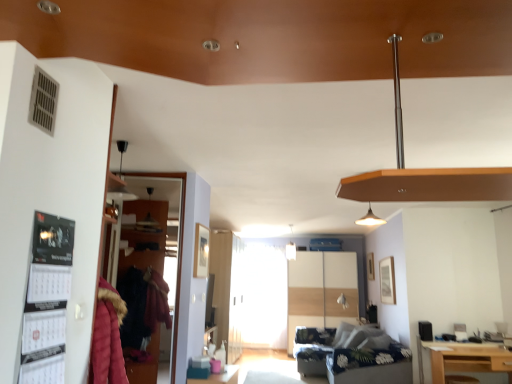
In order to click on dark blue floral fabric couch at lower center in this screenshot , I will do `click(354, 357)`.

I want to click on light brown wooden table at lower right, so click(463, 359).

Describe the element at coordinates (321, 290) in the screenshot. The height and width of the screenshot is (384, 512). I see `matte wood sliding door at center, the second glass door positioned from the left` at that location.

Identify the location of transparent glass door at left, placed as the second glass door when sorted from right to left. The image size is (512, 384). (178, 245).

Could you tell me if dark blue floral fabric couch at lower center is turned towards transparent glass door at left, which is the 1th glass door from front to back?

No, dark blue floral fabric couch at lower center is not aimed at transparent glass door at left, which is the 1th glass door from front to back.

From the image's perspective, is dark blue floral fabric couch at lower center located beneath transparent glass door at left, which is the 2th glass door from back to front?

Yes, from the image's perspective, dark blue floral fabric couch at lower center is beneath transparent glass door at left, which is the 2th glass door from back to front.

Is dark blue floral fabric couch at lower center at the left side of transparent glass door at left, arranged as the second glass door when ordered from the bottom?

No.

Who is taller, dark blue floral fabric couch at lower center or transparent glass door at left, arranged as the second glass door when ordered from the bottom?

transparent glass door at left, arranged as the second glass door when ordered from the bottom, is taller.

Between transparent glass door at left, which is the 1th glass door from front to back, and light brown wooden table at lower right, which one has less height?

With less height is light brown wooden table at lower right.

Is the surface of transparent glass door at left, placed as the second glass door when sorted from right to left, in direct contact with light brown wooden table at lower right?

No, transparent glass door at left, placed as the second glass door when sorted from right to left, is not next to light brown wooden table at lower right.

What's the angular difference between transparent glass door at left, which is the 1th glass door from front to back, and light brown wooden table at lower right's facing directions?

transparent glass door at left, which is the 1th glass door from front to back, and light brown wooden table at lower right are facing 0.289 degrees away from each other.

Is there a large distance between black paper calendar at left and dark blue floral fabric couch at lower center?

Yes.

Is black paper calendar at left looking in the opposite direction of dark blue floral fabric couch at lower center?

black paper calendar at left is not turned away from dark blue floral fabric couch at lower center.

From the image's perspective, who appears lower, black paper calendar at left or dark blue floral fabric couch at lower center?

dark blue floral fabric couch at lower center, from the image's perspective.

Can you confirm if black paper calendar at left is shorter than dark blue floral fabric couch at lower center?

Yes.

Considering the sizes of light brown wooden table at lower right and matte wood sliding door at center, the 1th glass door positioned from the back, in the image, is light brown wooden table at lower right wider or thinner than matte wood sliding door at center, the 1th glass door positioned from the back,?

Considering their sizes, light brown wooden table at lower right looks slimmer than matte wood sliding door at center, the 1th glass door positioned from the back.

Can you confirm if light brown wooden table at lower right is bigger than matte wood sliding door at center, which is counted as the 2th glass door, starting from the top?

No.

From a real-world perspective, which is physically below, light brown wooden table at lower right or matte wood sliding door at center, the 1th glass door positioned from the back?

In real-world perspective, light brown wooden table at lower right is lower.

Does point (498, 349) appear closer or farther from the camera than point (334, 291)?

Clearly, point (498, 349) is closer to the camera than point (334, 291).

From the image's perspective, is black paper calendar at left located above or below light brown wooden table at lower right?

Based on their image positions, black paper calendar at left is located above light brown wooden table at lower right.

Can you confirm if black paper calendar at left is wider than light brown wooden table at lower right?

In fact, black paper calendar at left might be narrower than light brown wooden table at lower right.

From a real-world perspective, between black paper calendar at left and light brown wooden table at lower right, who is vertically higher?

black paper calendar at left, from a real-world perspective.

This screenshot has width=512, height=384. Find the location of `table below the black paper calendar at left (from the image's perspective)`. table below the black paper calendar at left (from the image's perspective) is located at coordinates (463, 359).

How different are the orientations of matte wood sliding door at center, which appears as the 1th glass door when ordered from the bottom, and dark blue floral fabric couch at lower center in degrees?

90.6 degrees.

Who is smaller, matte wood sliding door at center, arranged as the first glass door when viewed from the right, or dark blue floral fabric couch at lower center?

Smaller between the two is dark blue floral fabric couch at lower center.

Could you measure the distance between matte wood sliding door at center, the 1th glass door positioned from the back, and dark blue floral fabric couch at lower center?

The distance of matte wood sliding door at center, the 1th glass door positioned from the back, from dark blue floral fabric couch at lower center is 1.46 meters.

Identify the location of the 1st glass door to the left when counting from the dark blue floral fabric couch at lower center. This screenshot has width=512, height=384. (321, 290).

Which is more distant, [369,354] or [51,319]?

Positioned behind is point [369,354].

Which is behind, dark blue floral fabric couch at lower center or black paper calendar at left?

dark blue floral fabric couch at lower center is further away from the camera.

Does dark blue floral fabric couch at lower center have a greater width compared to black paper calendar at left?

Correct, the width of dark blue floral fabric couch at lower center exceeds that of black paper calendar at left.

Image resolution: width=512 pixels, height=384 pixels. In order to click on studio couch behind the transparent glass door at left, placed as the second glass door when sorted from right to left in this screenshot , I will do `click(354, 357)`.

What are the coordinates of `table below the transparent glass door at left, which appears as the 1th glass door when viewed from the left (from the image's perspective)` in the screenshot? It's located at (463, 359).

From the image, which object appears to be nearer to light brown wooden table at lower right, matte wood sliding door at center, the second glass door positioned from the left, or transparent glass door at left, arranged as the second glass door when ordered from the bottom?

The object closer to light brown wooden table at lower right is matte wood sliding door at center, the second glass door positioned from the left.

From the image, which object appears to be nearer to dark blue floral fabric couch at lower center, light brown wooden table at lower right or transparent glass door at left, which is the 2th glass door from back to front?

Based on the image, light brown wooden table at lower right appears to be nearer to dark blue floral fabric couch at lower center.

Estimate the real-world distances between objects in this image. Which object is further from matte wood sliding door at center, which appears as the 1th glass door when ordered from the bottom, light brown wooden table at lower right or black paper calendar at left?

black paper calendar at left.

Looking at the image, which one is located closer to dark blue floral fabric couch at lower center, black paper calendar at left or matte wood sliding door at center, the second glass door in the front-to-back sequence?

matte wood sliding door at center, the second glass door in the front-to-back sequence.

Estimate the real-world distances between objects in this image. Which object is further from black paper calendar at left, dark blue floral fabric couch at lower center or light brown wooden table at lower right?

dark blue floral fabric couch at lower center is positioned further to the anchor black paper calendar at left.

When comparing their distances from dark blue floral fabric couch at lower center, does matte wood sliding door at center, the second glass door positioned from the left, or light brown wooden table at lower right seem further?

matte wood sliding door at center, the second glass door positioned from the left, is positioned further to the anchor dark blue floral fabric couch at lower center.

From the image, which object appears to be nearer to dark blue floral fabric couch at lower center, transparent glass door at left, arranged as the second glass door when ordered from the bottom, or matte wood sliding door at center, the second glass door in the front-to-back sequence?

The object closer to dark blue floral fabric couch at lower center is matte wood sliding door at center, the second glass door in the front-to-back sequence.

From the image, which object appears to be farther from dark blue floral fabric couch at lower center, light brown wooden table at lower right or matte wood sliding door at center, the second glass door in the front-to-back sequence?

matte wood sliding door at center, the second glass door in the front-to-back sequence, is positioned further to the anchor dark blue floral fabric couch at lower center.

This screenshot has width=512, height=384. In order to click on table positioned between black paper calendar at left and dark blue floral fabric couch at lower center from near to far in this screenshot , I will do `click(463, 359)`.

The height and width of the screenshot is (384, 512). Identify the location of glass door between black paper calendar at left and dark blue floral fabric couch at lower center along the z-axis. (x=178, y=245).

Identify the location of studio couch between transparent glass door at left, which is the 2th glass door from back to front, and light brown wooden table at lower right, in the horizontal direction. The image size is (512, 384). (354, 357).

Find the location of a particular element. The image size is (512, 384). glass door between black paper calendar at left and matte wood sliding door at center, the second glass door positioned from the left, from front to back is located at coordinates (178, 245).